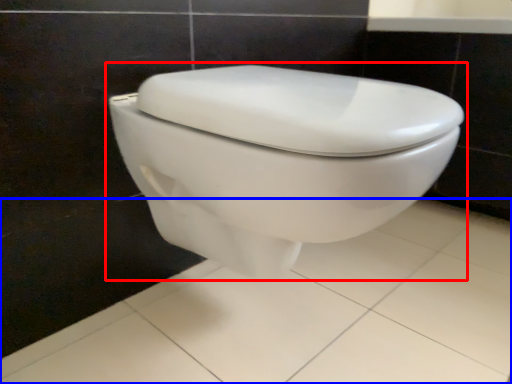
Question: Which object appears farthest to the camera in this image, toilet (highlighted by a red box) or porcelain (highlighted by a blue box)?

Choices:
 (A) toilet
 (B) porcelain

Answer: (A)